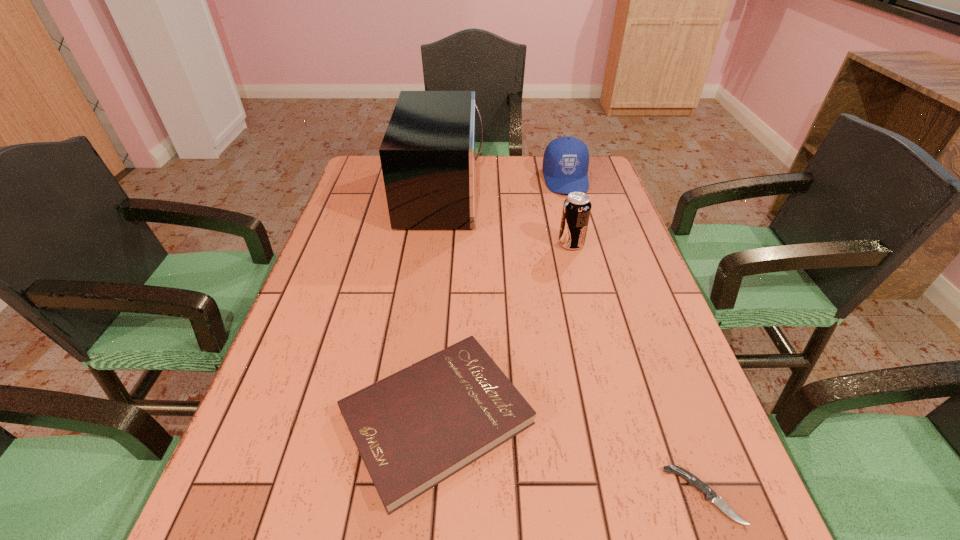
This screenshot has height=540, width=960. In the image, there is a desktop. Identify the location of vacant space at the far left corner. (369, 170).

This screenshot has width=960, height=540. What are the coordinates of `vacant space at the far right corner of the desktop` in the screenshot? It's located at (612, 187).

Locate an element on the screen. free area in between the pocketknife and the third tallest object is located at coordinates (635, 337).

The height and width of the screenshot is (540, 960). I want to click on empty location between the pocketknife and the third farthest object, so click(x=637, y=369).

Where is `empty space that is in between the cap and the tallest object`? The image size is (960, 540). empty space that is in between the cap and the tallest object is located at coordinates (504, 186).

The image size is (960, 540). Identify the location of free space between the microwave oven and the soda can. (507, 219).

Identify the location of vacant area between the microwave oven and the hardback book. (439, 305).

The image size is (960, 540). I want to click on free point between the pocketknife and the third farthest object, so click(637, 369).

You are a GUI agent. You are given a task and a screenshot of the screen. Output one action in this format:
    pyautogui.click(x=<x>, y=<y>)
    Task: Click on the vacant space that's between the fourth tallest object and the cap
    The height and width of the screenshot is (540, 960).
    Given the screenshot: What is the action you would take?
    pyautogui.click(x=501, y=298)

Where is `vacant point located between the shortest object and the third farthest object`? vacant point located between the shortest object and the third farthest object is located at coordinates (637, 369).